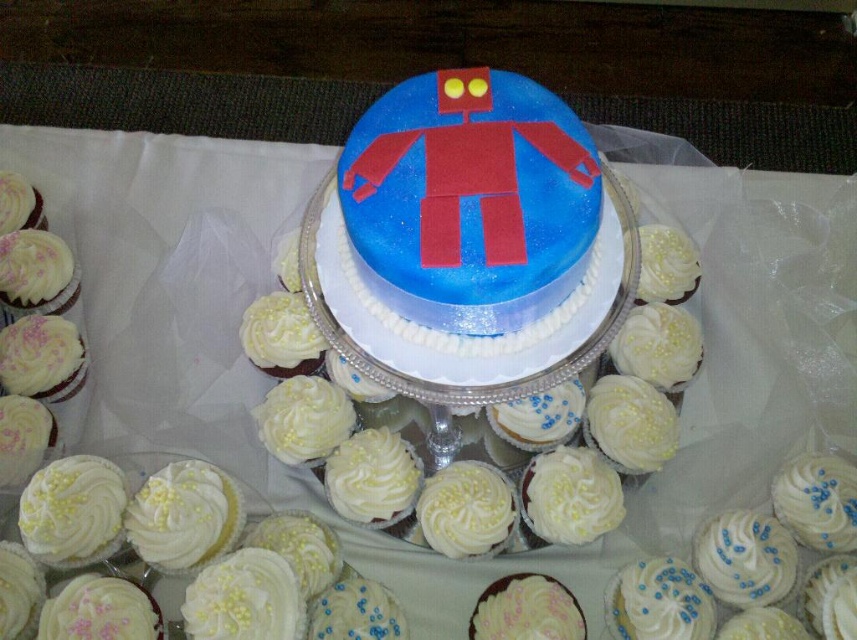
Question: Is blue fondant robot at center positioned before white frosted cupcake at center?

Choices:
 (A) yes
 (B) no

Answer: (A)

Question: Which of the following is the closest to the observer?

Choices:
 (A) blue fondant robot at center
 (B) white frosted cupcake at center

Answer: (A)

Question: Can you confirm if blue fondant robot at center is smaller than white frosted cupcake at center?

Choices:
 (A) yes
 (B) no

Answer: (B)

Question: Among these objects, which one is farthest from the camera?

Choices:
 (A) blue fondant robot at center
 (B) white frosted cupcake at center

Answer: (B)

Question: Can you confirm if blue fondant robot at center is positioned to the left of white frosted cupcake at center?

Choices:
 (A) yes
 (B) no

Answer: (A)